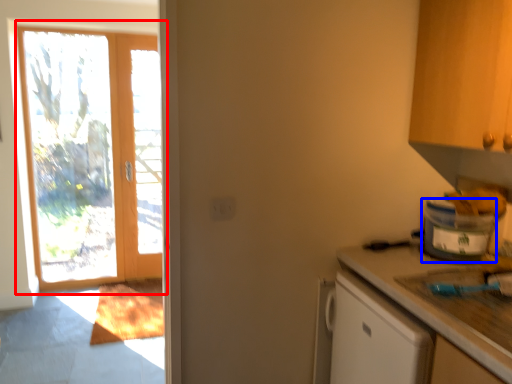
Question: Among these objects, which one is nearest to the camera, door (highlighted by a red box) or appliance (highlighted by a blue box)?

Choices:
 (A) door
 (B) appliance

Answer: (B)